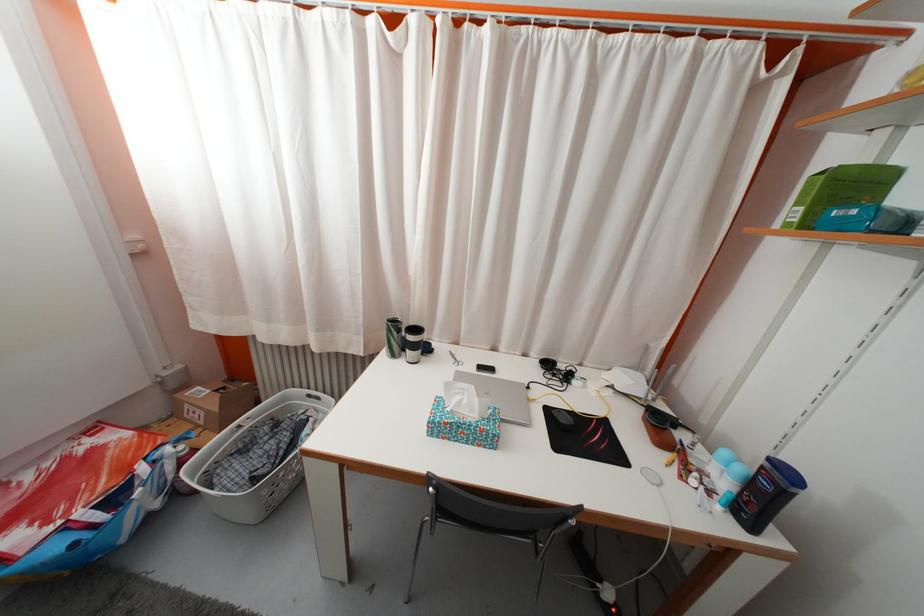
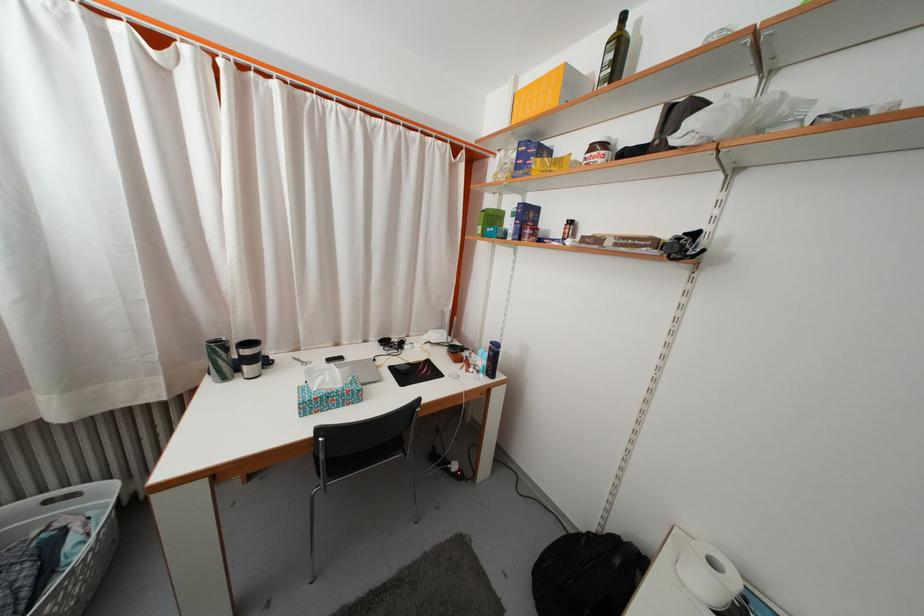
Locate, in the second image, the point that corresponds to the point at 314,395 in the first image.

(49, 498)